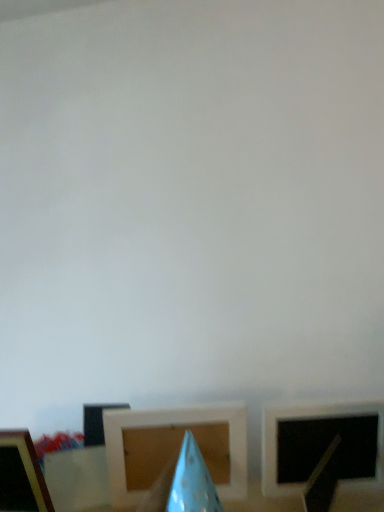
Question: Is wooden at center, acting as the second picture frame starting from the left, behind wooden picture frame at lower left, the 3th picture frame from the right?

Choices:
 (A) yes
 (B) no

Answer: (A)

Question: Is wooden at center, acting as the second picture frame starting from the right, to the right of wooden picture frame at lower left, the 3th picture frame from the right, from the viewer's perspective?

Choices:
 (A) no
 (B) yes

Answer: (B)

Question: Is wooden at center, acting as the second picture frame starting from the right, thinner than wooden picture frame at lower left, the 3th picture frame from the right?

Choices:
 (A) no
 (B) yes

Answer: (B)

Question: Is wooden at center, acting as the second picture frame starting from the right, positioned before wooden picture frame at lower left, the first picture frame in the left-to-right sequence?

Choices:
 (A) no
 (B) yes

Answer: (A)

Question: Could you tell me if wooden at center, acting as the second picture frame starting from the left, is facing wooden picture frame at lower left, the 3th picture frame from the right?

Choices:
 (A) yes
 (B) no

Answer: (B)

Question: Looking at their shapes, would you say wooden at center, acting as the second picture frame starting from the right, is wider or thinner than wooden picture frame at lower left, the first picture frame in the left-to-right sequence?

Choices:
 (A) wide
 (B) thin

Answer: (B)

Question: Relative to wooden picture frame at lower left, the first picture frame in the left-to-right sequence, is wooden at center, acting as the second picture frame starting from the left, in front or behind?

Choices:
 (A) behind
 (B) front

Answer: (A)

Question: From a real-world perspective, relative to wooden picture frame at lower left, the first picture frame in the left-to-right sequence, is wooden at center, acting as the second picture frame starting from the left, vertically above or below?

Choices:
 (A) above
 (B) below

Answer: (B)

Question: Visually, is wooden at center, acting as the second picture frame starting from the right, positioned to the left or to the right of wooden picture frame at lower left, the 3th picture frame from the right?

Choices:
 (A) right
 (B) left

Answer: (A)

Question: From a real-world perspective, is matte white picture frame at right, which is the first picture frame from right to left, above or below wooden at center, acting as the second picture frame starting from the right?

Choices:
 (A) below
 (B) above

Answer: (B)

Question: Is matte white picture frame at right, which is the first picture frame from right to left, inside the boundaries of wooden at center, acting as the second picture frame starting from the left, or outside?

Choices:
 (A) outside
 (B) inside

Answer: (A)

Question: From the image's perspective, is matte white picture frame at right, which is counted as the 3th picture frame, starting from the left, located above or below wooden at center, acting as the second picture frame starting from the left?

Choices:
 (A) below
 (B) above

Answer: (B)

Question: Is matte white picture frame at right, which is the first picture frame from right to left, taller or shorter than wooden at center, acting as the second picture frame starting from the right?

Choices:
 (A) short
 (B) tall

Answer: (A)

Question: Considering the relative positions of wooden at center, acting as the second picture frame starting from the right, and blue paper cone at center in the image provided, is wooden at center, acting as the second picture frame starting from the right, to the left or to the right of blue paper cone at center?

Choices:
 (A) left
 (B) right

Answer: (A)

Question: Is point (236, 413) positioned closer to the camera than point (185, 476)?

Choices:
 (A) closer
 (B) farther

Answer: (B)